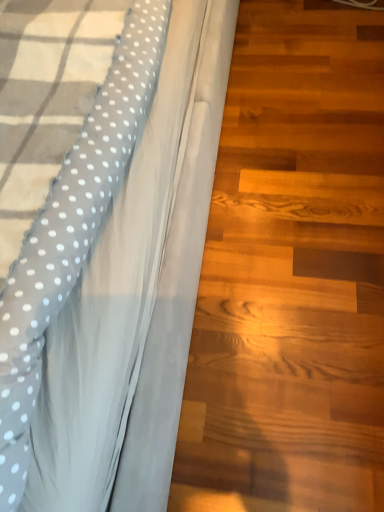
Locate an element on the screen. This screenshot has height=512, width=384. white polka dot fabric at upper left is located at coordinates (116, 275).

The width and height of the screenshot is (384, 512). Describe the element at coordinates (116, 275) in the screenshot. I see `white polka dot fabric at upper left` at that location.

At what (x,y) coordinates should I click in order to perform the action: click on white polka dot fabric at upper left. Please return your answer as a coordinate pair (x, y). The image size is (384, 512). Looking at the image, I should click on (116, 275).